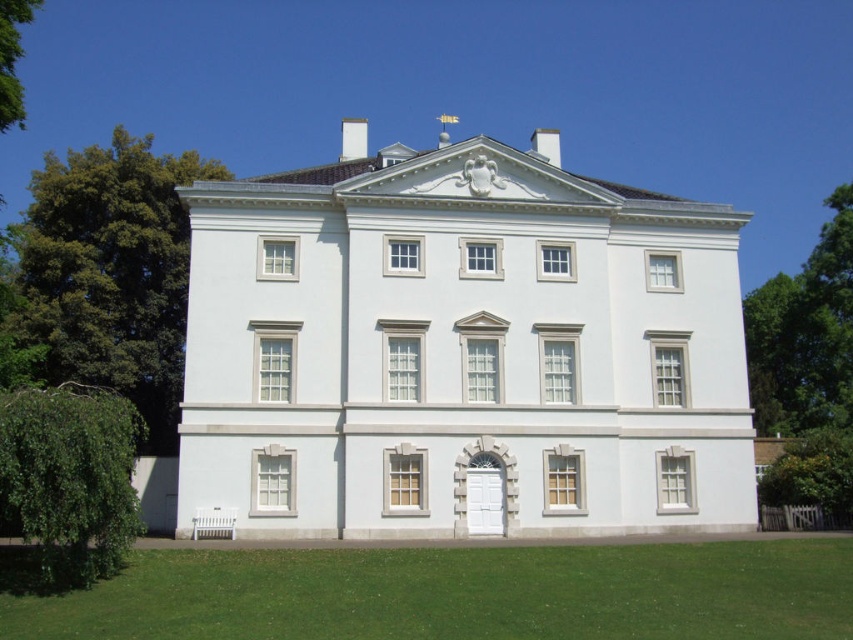
From the picture: You are a photographer planning to capture the white smooth building at center and the green leafy tree at lower left in a single frame. Based on their sizes in the image, which one would appear larger in the photo?

The white smooth building at center appears larger in the photo because it is much taller than the green leafy tree at lower left.

You are an architect designing a new garden layout for the property. The garden must include both the white smooth building at center and the green leafy tree at lower left. Considering their sizes, which object should be placed closer to the entrance for better visual balance?

The white smooth building at center should be placed closer to the entrance since it is wider than the green leafy tree at lower left, ensuring a balanced composition by counterbalancing the larger structure with strategic placement.